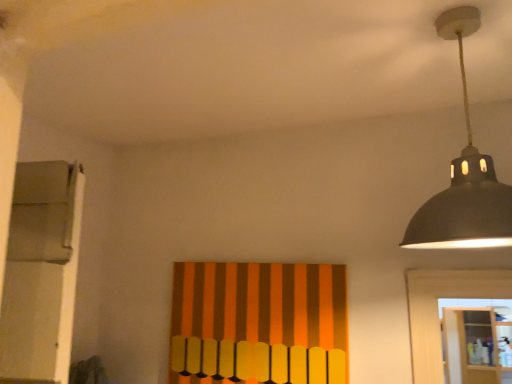
Question: From their relative heights in the image, would you say orange striped fabric at center is taller or shorter than wooden cabinet at lower right?

Choices:
 (A) tall
 (B) short

Answer: (B)

Question: Does point (330, 268) appear closer or farther from the camera than point (464, 345)?

Choices:
 (A) farther
 (B) closer

Answer: (B)

Question: Estimate the real-world distances between objects in this image. Which object is closer to the matte black lampshade at upper right?

Choices:
 (A) orange striped fabric at center
 (B) wooden cabinet at lower right

Answer: (A)

Question: Estimate the real-world distances between objects in this image. Which object is closer to the wooden cabinet at lower right?

Choices:
 (A) orange striped fabric at center
 (B) matte black lampshade at upper right

Answer: (A)